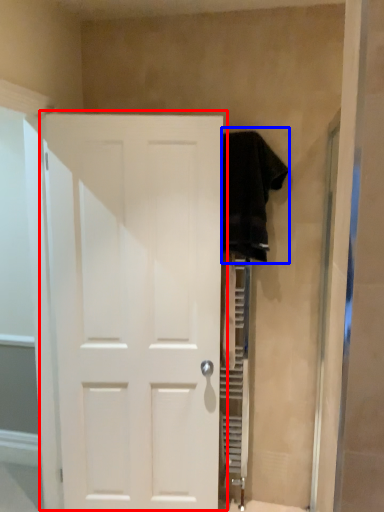
Question: Which of the following is the closest to the observer, door (highlighted by a red box) or clothing (highlighted by a blue box)?

Choices:
 (A) door
 (B) clothing

Answer: (A)